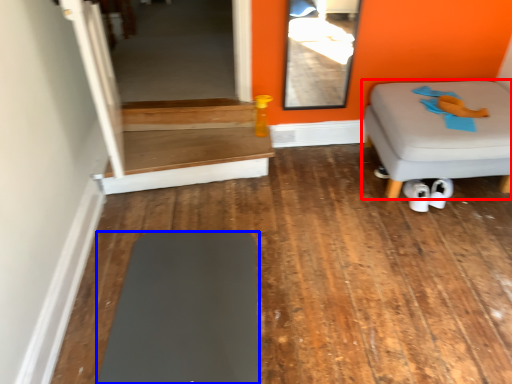
Question: Among these objects, which one is farthest to the camera, furniture (highlighted by a red box) or furniture (highlighted by a blue box)?

Choices:
 (A) furniture
 (B) furniture

Answer: (A)